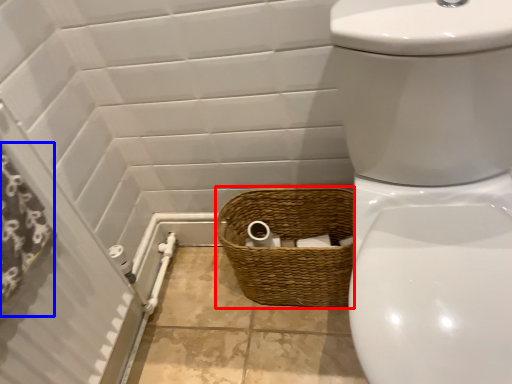
Question: Which of the following is the farthest to the observer, basket (highlighted by a red box) or shower curtain (highlighted by a blue box)?

Choices:
 (A) basket
 (B) shower curtain

Answer: (A)